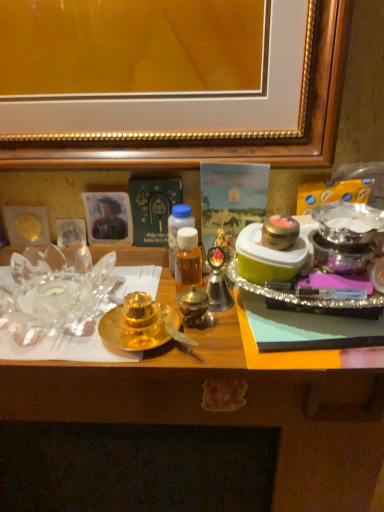
At what (x,y) coordinates should I click in order to perform the action: click on blank space above gold metallic tray at center (from a real-world perspective). Please return your answer as a coordinate pair (x, y). The height and width of the screenshot is (512, 384). Looking at the image, I should click on (177, 313).